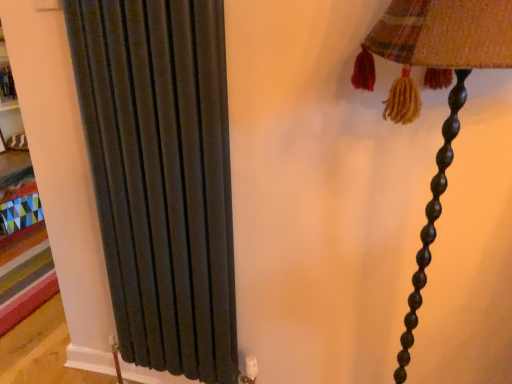
Image resolution: width=512 pixels, height=384 pixels. I want to click on matte brown lampshade at upper right, so click(x=449, y=93).

Image resolution: width=512 pixels, height=384 pixels. What do you see at coordinates (449, 93) in the screenshot?
I see `matte brown lampshade at upper right` at bounding box center [449, 93].

Image resolution: width=512 pixels, height=384 pixels. I want to click on matte brown lampshade at upper right, so click(449, 93).